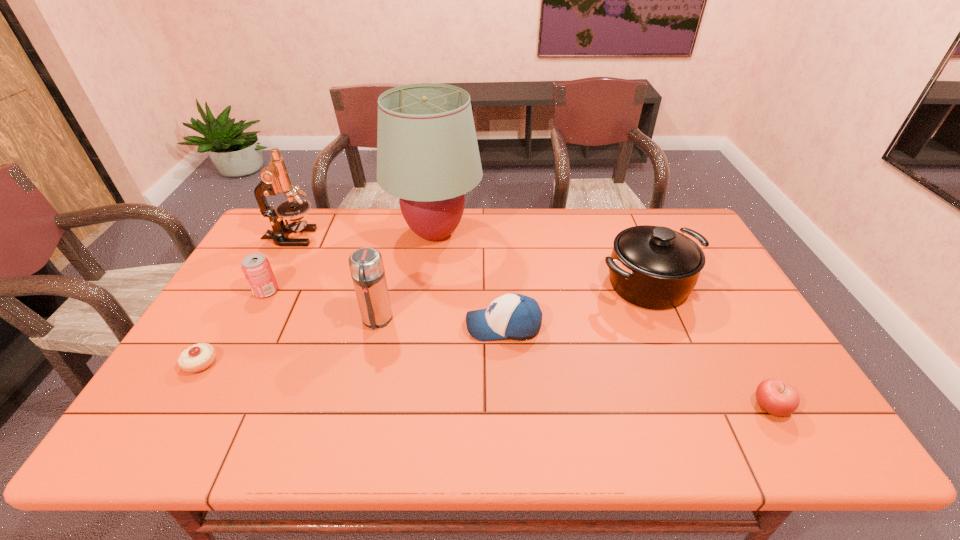
The width and height of the screenshot is (960, 540). In order to click on unoccupied position between the apple and the saucepan in this screenshot , I will do `click(708, 345)`.

Where is `vacant space that's between the shortest object and the tallest object`? vacant space that's between the shortest object and the tallest object is located at coordinates (318, 298).

Locate an element on the screen. The width and height of the screenshot is (960, 540). free space between the tallest object and the nearest object is located at coordinates (603, 320).

Identify which object is the seventh closest to the thermos bottle. Please provide its 2D coordinates. Your answer should be formatted as a tuple, i.e. [(x, y)], where the tuple contains the x and y coordinates of a point satisfying the conditions above.

[(777, 397)]

This screenshot has height=540, width=960. I want to click on the closest object to the fifth shortest object, so click(514, 316).

You are a GUI agent. You are given a task and a screenshot of the screen. Output one action in this format:
    pyautogui.click(x=<x>, y=<y>)
    Task: Click on the vacant area in the image that satisfies the following two spatial constraints: 1. at the eyepiece of the second shortest object; 2. on the right side of the microscope
    
    Given the screenshot: What is the action you would take?
    pyautogui.click(x=198, y=406)

Where is `vacant space that satisfies the following two spatial constraints: 1. on the back side of the pastry; 2. on the right side of the fourth shortest object`? vacant space that satisfies the following two spatial constraints: 1. on the back side of the pastry; 2. on the right side of the fourth shortest object is located at coordinates (244, 291).

Where is `vacant space that satisfies the following two spatial constraints: 1. on the front side of the apple; 2. on the right side of the tallest object`? Image resolution: width=960 pixels, height=540 pixels. vacant space that satisfies the following two spatial constraints: 1. on the front side of the apple; 2. on the right side of the tallest object is located at coordinates (412, 406).